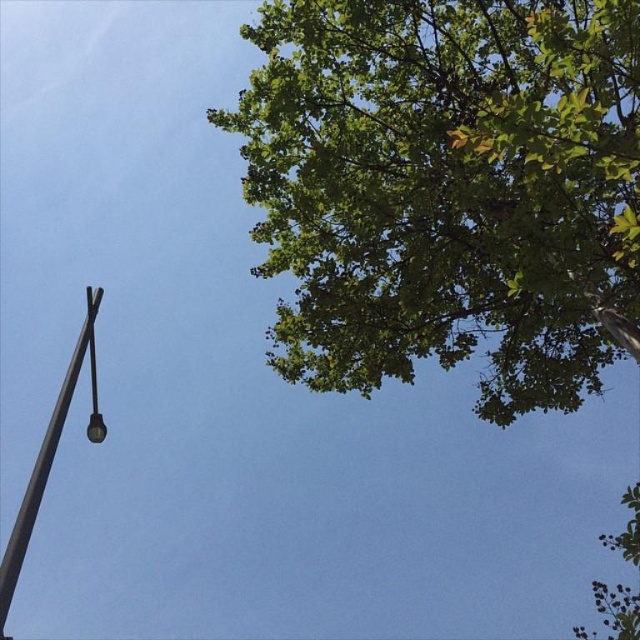
In the scene shown: Based on the scene description, where is the green leafy tree at upper right located in the image?

The green leafy tree at upper right is located at point (448, 189) in the image.